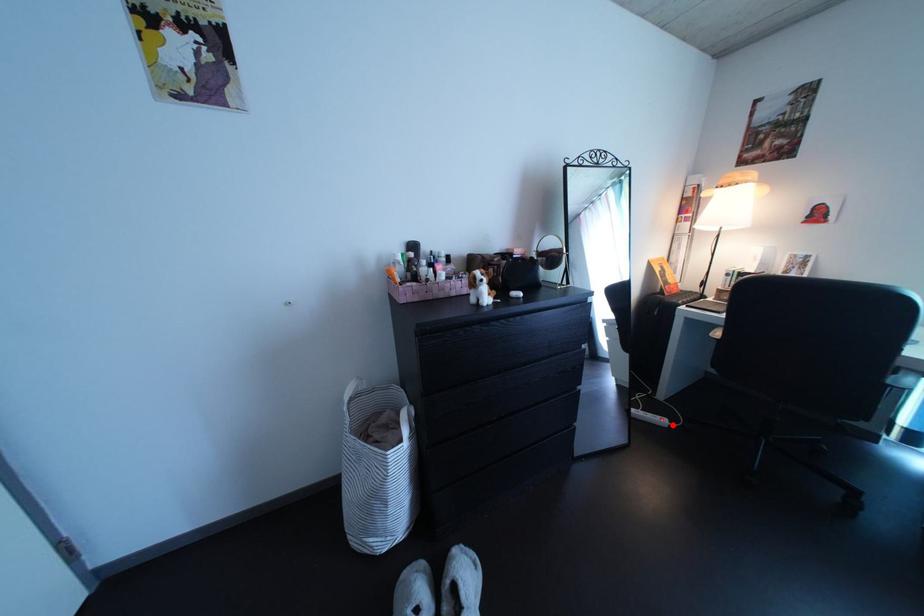
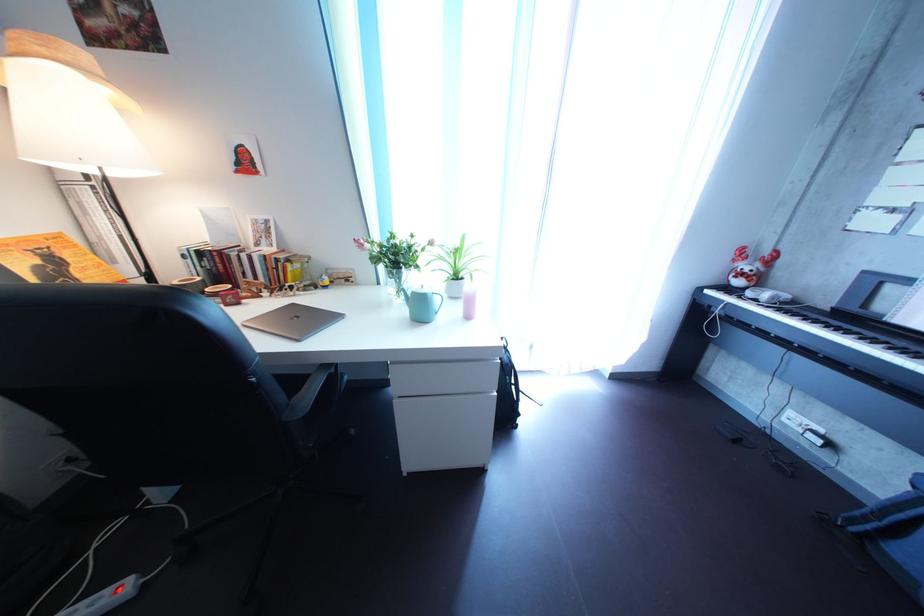
Question: I am providing you with two images of the same scene from different viewpoints. Given a red point in image1, look at the same physical point in image2. Is it:

Choices:
 (A) Closer to the viewpoint
 (B) Farther from the viewpoint

Answer: (A)